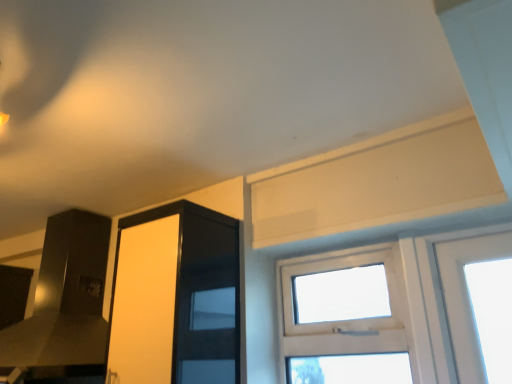
Locate an element on the screen. transparent glass window at center is located at coordinates (346, 320).

Describe the element at coordinates (346, 320) in the screenshot. I see `transparent glass window at center` at that location.

What is the approximate width of transparent glass screen door at upper left?

12.34 inches.

Locate an element on the screen. The height and width of the screenshot is (384, 512). transparent glass screen door at upper left is located at coordinates (176, 297).

What do you see at coordinates (176, 297) in the screenshot? I see `transparent glass screen door at upper left` at bounding box center [176, 297].

The height and width of the screenshot is (384, 512). What are the coordinates of `transparent glass window at center` in the screenshot? It's located at (346, 320).

Is transparent glass screen door at upper left to the left of transparent glass window at center from the viewer's perspective?

Yes.

Which object is further away from the camera, transparent glass screen door at upper left or transparent glass window at center?

transparent glass window at center is further from the camera.

Considering the positions of points (191, 323) and (279, 298), is point (191, 323) closer to camera compared to point (279, 298)?

Yes, point (191, 323) is in front of point (279, 298).

From the image's perspective, which is below, transparent glass screen door at upper left or transparent glass window at center?

transparent glass window at center appears lower in the image.

From a real-world perspective, which is physically below, transparent glass screen door at upper left or transparent glass window at center?

transparent glass window at center.

Is transparent glass screen door at upper left wider or thinner than transparent glass window at center?

Clearly, transparent glass screen door at upper left has more width compared to transparent glass window at center.

Can you confirm if transparent glass screen door at upper left is taller than transparent glass window at center?

Yes.

Can you confirm if transparent glass screen door at upper left is smaller than transparent glass window at center?

No.

Is transparent glass window at center completely or partially inside transparent glass screen door at upper left?

No, transparent glass screen door at upper left does not contain transparent glass window at center.

Would you consider transparent glass screen door at upper left to be distant from transparent glass window at center?

No, transparent glass screen door at upper left is not far away from transparent glass window at center.

Could you tell me if transparent glass screen door at upper left is turned towards transparent glass window at center?

No, transparent glass screen door at upper left does not turn towards transparent glass window at center.

At what (x,y) coordinates should I click in order to perform the action: click on screen door that is on the left side of transparent glass window at center. Please return your answer as a coordinate pair (x, y). The image size is (512, 384). Looking at the image, I should click on (176, 297).

Can you confirm if transparent glass window at center is positioned to the left of transparent glass screen door at upper left?

No.

Is the position of transparent glass window at center more distant than that of transparent glass screen door at upper left?

Yes, transparent glass window at center is further from the camera.

Is point (398, 250) closer or farther from the camera than point (145, 228)?

Point (398, 250) is positioned closer to the camera compared to point (145, 228).

From the image's perspective, between transparent glass window at center and transparent glass screen door at upper left, which one is located above?

From the image's view, transparent glass screen door at upper left is above.

From a real-world perspective, does transparent glass window at center stand above transparent glass screen door at upper left?

No.

Which object is thinner, transparent glass window at center or transparent glass screen door at upper left?

With smaller width is transparent glass window at center.

Considering the relative sizes of transparent glass window at center and transparent glass screen door at upper left in the image provided, is transparent glass window at center taller than transparent glass screen door at upper left?

No, transparent glass window at center is not taller than transparent glass screen door at upper left.

Who is smaller, transparent glass window at center or transparent glass screen door at upper left?

transparent glass window at center is smaller.

Is transparent glass screen door at upper left a part of transparent glass window at center?

Actually, transparent glass screen door at upper left is outside transparent glass window at center.

Are transparent glass window at center and transparent glass screen door at upper left located far from each other?

No, transparent glass window at center is not far from transparent glass screen door at upper left.

Is transparent glass window at center turned away from transparent glass screen door at upper left?

transparent glass window at center does not have its back to transparent glass screen door at upper left.

How different are the orientations of transparent glass window at center and transparent glass screen door at upper left in degrees?

The angular difference between transparent glass window at center and transparent glass screen door at upper left is 3.4 degrees.

How far apart are transparent glass window at center and transparent glass screen door at upper left?

The distance of transparent glass window at center from transparent glass screen door at upper left is 16.29 inches.

Identify the location of screen door that appears in front of the transparent glass window at center. This screenshot has width=512, height=384. (176, 297).

Find the location of a particular element. The height and width of the screenshot is (384, 512). window on the right of the transparent glass screen door at upper left is located at coordinates (346, 320).

Locate an element on the screen. This screenshot has height=384, width=512. screen door on the left of transparent glass window at center is located at coordinates (176, 297).